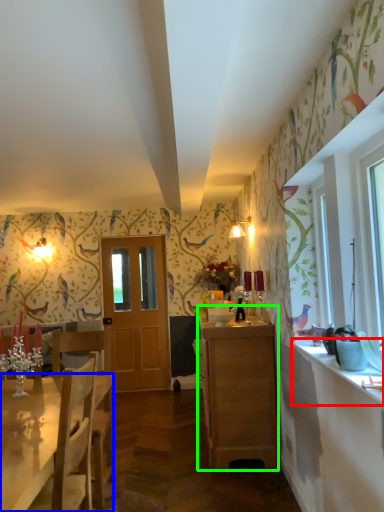
Question: Which object is positioned farthest from counter top (highlighted by a red box)? Select from desk (highlighted by a blue box) and cabinetry (highlighted by a green box).

Choices:
 (A) desk
 (B) cabinetry

Answer: (A)